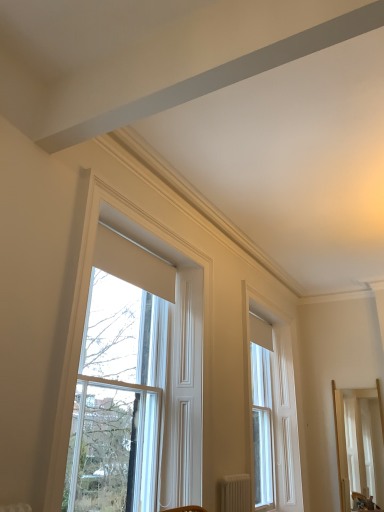
Question: Based on their sizes in the image, would you say light wood mirror at right is bigger or smaller than white matte radiator at lower center?

Choices:
 (A) big
 (B) small

Answer: (A)

Question: From a real-world perspective, is light wood mirror at right physically located above or below white matte radiator at lower center?

Choices:
 (A) below
 (B) above

Answer: (B)

Question: Which object is the closest to the white matte radiator at lower center?

Choices:
 (A) white wood window at upper center, which is the second window in right-to-left order
 (B) white wood window at center, acting as the 2th window starting from the front
 (C) light wood mirror at right

Answer: (A)

Question: Which of these objects is positioned closest to the white wood window at center, the 1th window from the right?

Choices:
 (A) light wood mirror at right
 (B) white matte radiator at lower center
 (C) white wood window at upper center, arranged as the 2th window when viewed from the back

Answer: (A)